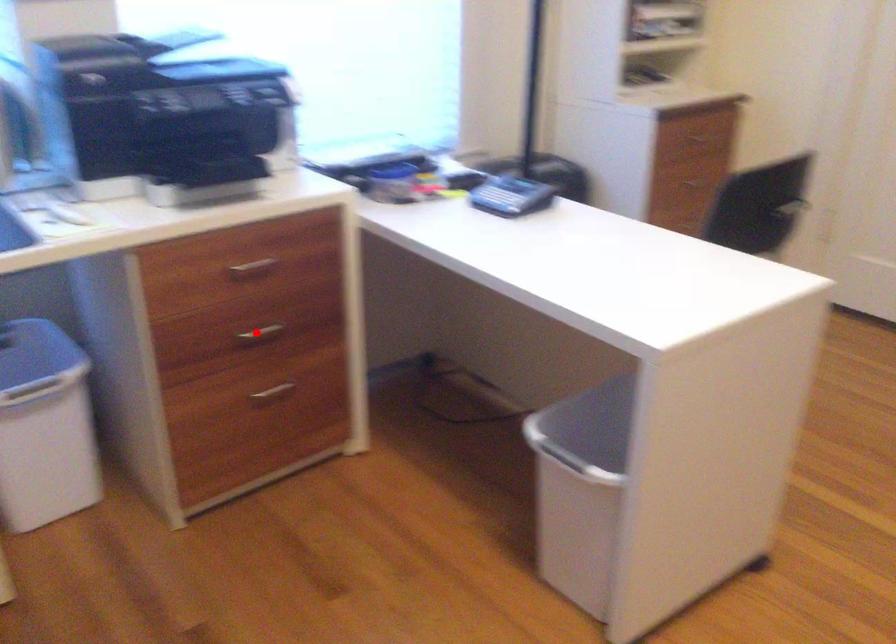
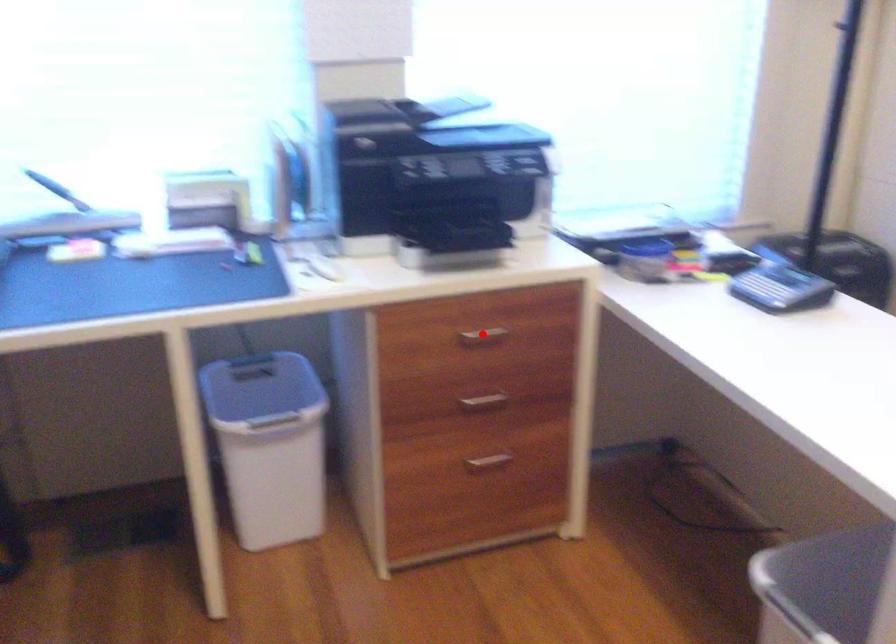
I am providing you with two images of the same scene from different viewpoints. A red point is marked on the first image and another point is marked on the second image. Does the point marked in image1 correspond to the same location as the one in image2?

No